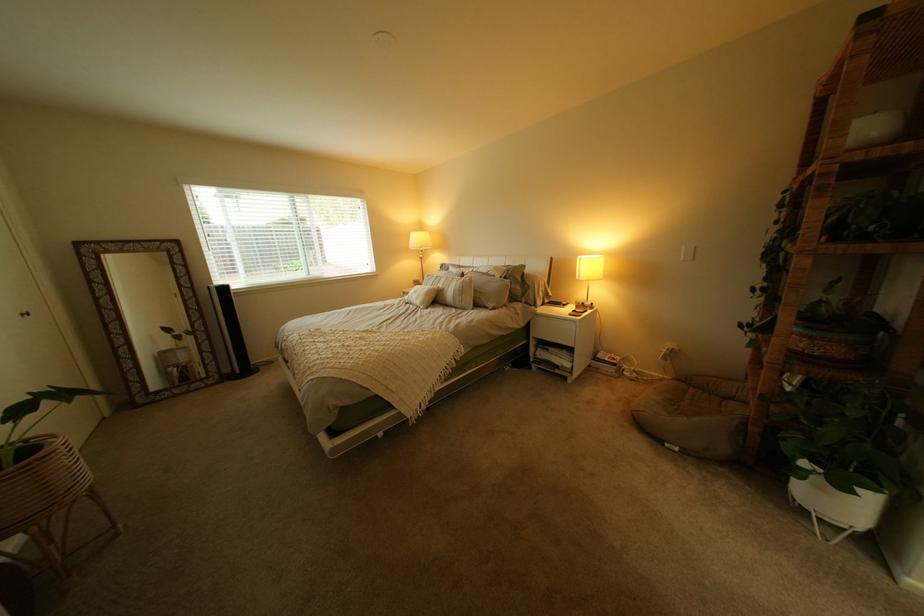
Where is `grey bed pillow`? The width and height of the screenshot is (924, 616). grey bed pillow is located at coordinates (489, 291).